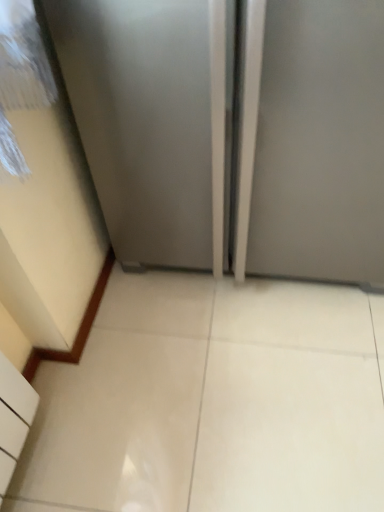
The height and width of the screenshot is (512, 384). What do you see at coordinates (233, 131) in the screenshot?
I see `satin silver refrigerator at center` at bounding box center [233, 131].

In order to click on satin silver refrigerator at center in this screenshot , I will do `click(233, 131)`.

This screenshot has width=384, height=512. Find the location of `satin silver refrigerator at center`. satin silver refrigerator at center is located at coordinates (233, 131).